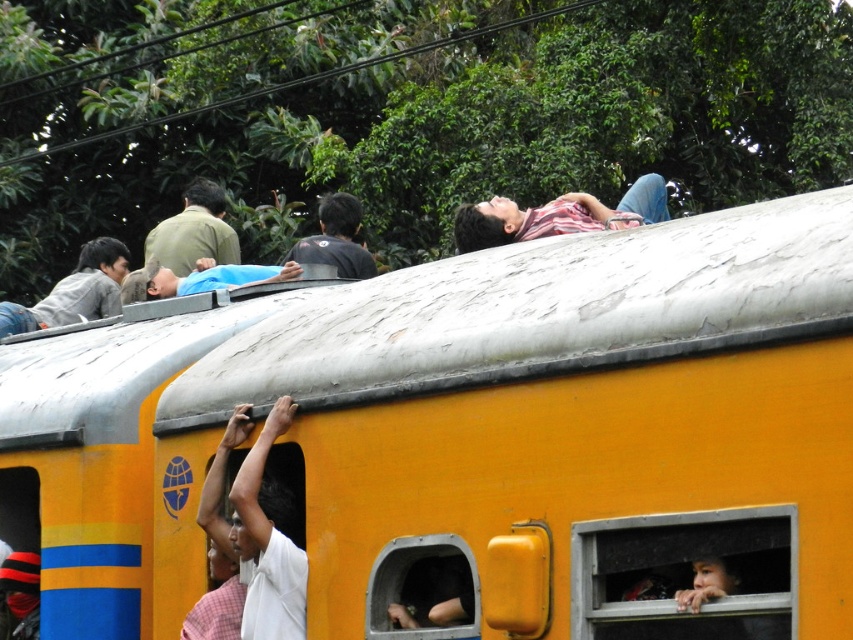
Between point (666, 564) and point (199, 200), which one is positioned behind?

Point (199, 200)

The width and height of the screenshot is (853, 640). Identify the location of transparent glass window at lower right. (686, 576).

At what (x,y) coordinates should I click in order to perform the action: click on transparent glass window at lower right. Please return your answer as a coordinate pair (x, y). This screenshot has width=853, height=640. Looking at the image, I should click on (686, 576).

The width and height of the screenshot is (853, 640). I want to click on yellow matte train car at upper center, so click(485, 429).

Does yellow matte train car at upper center appear over transparent glass window at lower right?

Yes.

What are the coordinates of `yellow matte train car at upper center` in the screenshot? It's located at (485, 429).

Looking at this image, between metallic gray window at center and green matte shirt at upper left, which one appears on the right side from the viewer's perspective?

metallic gray window at center

Is point (426, 628) closer to viewer compared to point (161, 234)?

Yes, point (426, 628) is closer to viewer.

The width and height of the screenshot is (853, 640). In order to click on metallic gray window at center in this screenshot , I will do `click(419, 586)`.